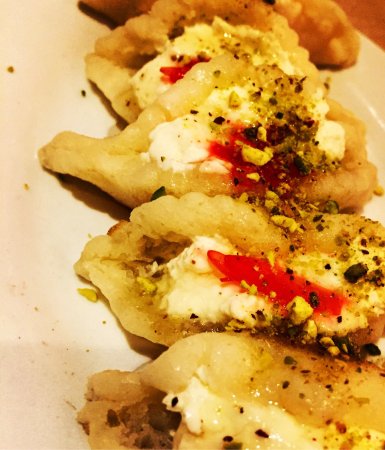
Identify the location of table. (372, 16).